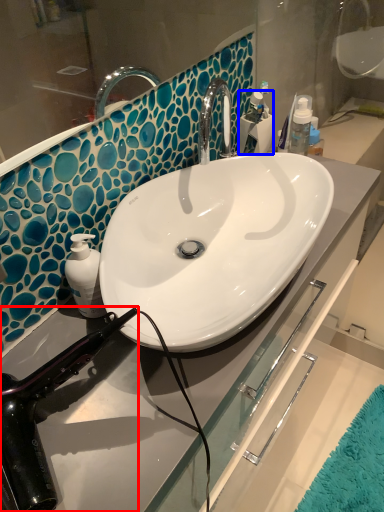
Question: Which object is closer to the camera taking this photo, hair drier (highlighted by a red box) or toiletry (highlighted by a blue box)?

Choices:
 (A) hair drier
 (B) toiletry

Answer: (A)